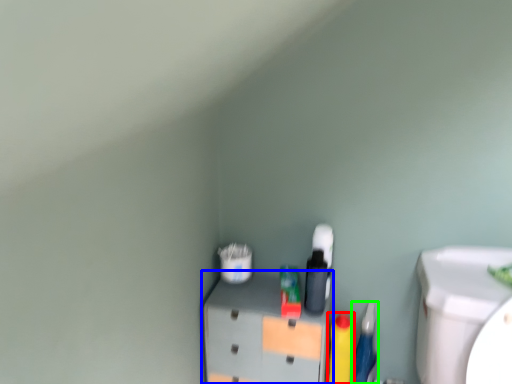
Question: Which object is the farthest from cleaning product (highlighted by a red box)? Choose among these: furniture (highlighted by a blue box) or stationery (highlighted by a green box).

Choices:
 (A) furniture
 (B) stationery

Answer: (A)